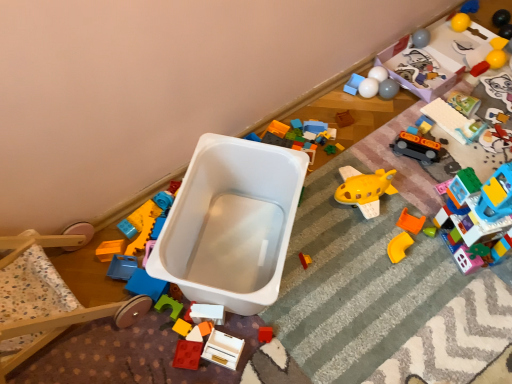
What are the coordinates of `vacant space in between orange matte plastic corner piece at lower right, the ninth toy positioned from the right, and wooden toy box at center, the thirteenth toy positioned from the right` in the screenshot? It's located at (316, 297).